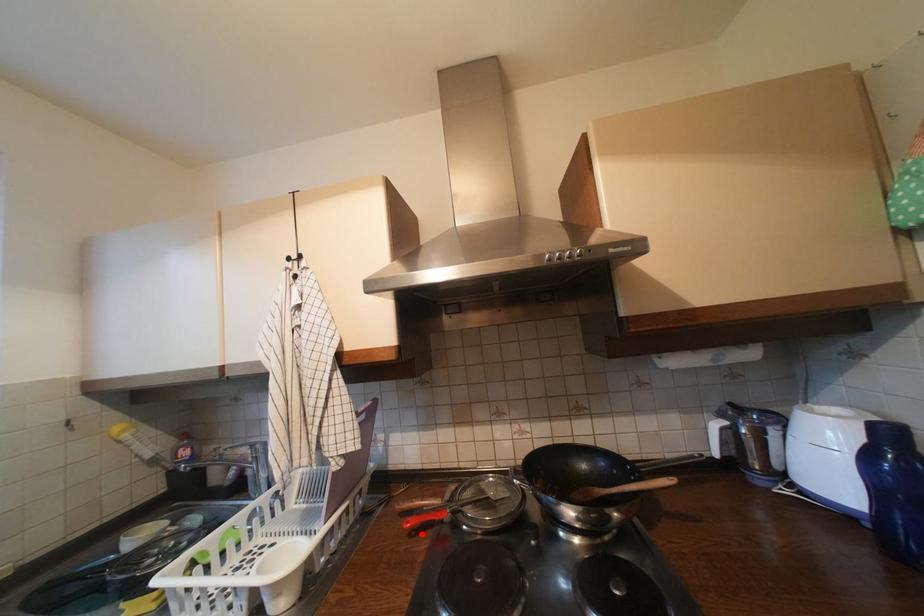
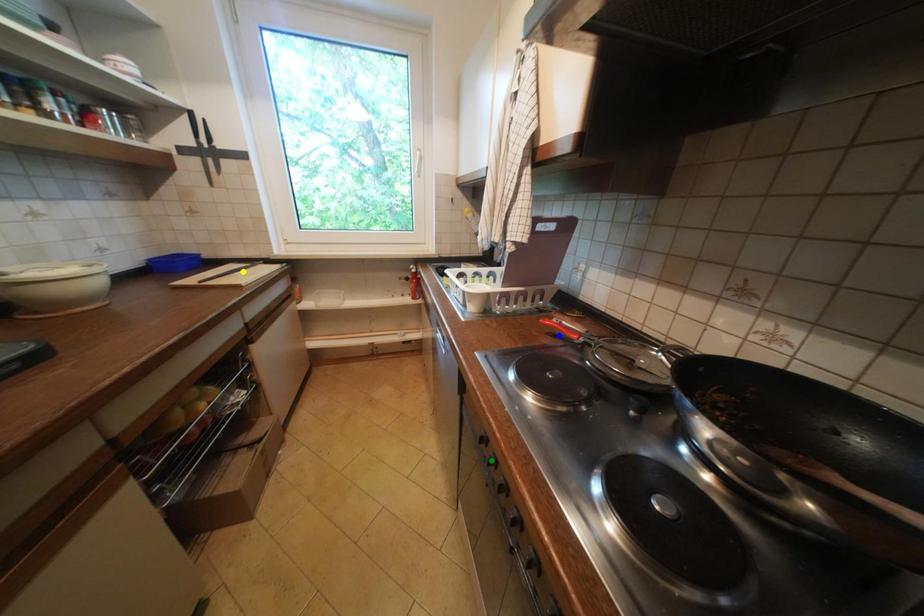
Question: I am providing you with two images of the same scene from different viewpoints. A red point is marked on the first image. You are given multiple points on the second image. Which mark in image 2 goes with the point in image 1?

Choices:
 (A) blue point
 (B) yellow point
 (C) green point

Answer: (A)